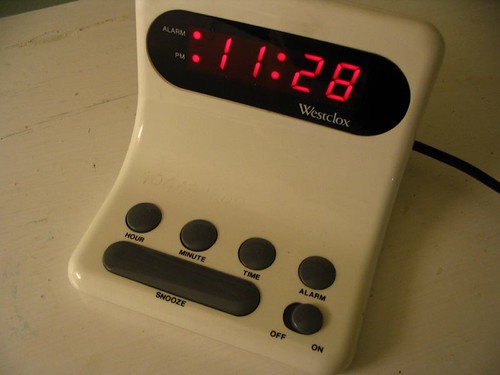
You are a GUI agent. You are given a task and a screenshot of the screen. Output one action in this format:
    pyautogui.click(x=<x>, y=<y>)
    Task: Click on the time on clock in red letters - 11:28
    This screenshot has height=375, width=500.
    Given the screenshot: What is the action you would take?
    pyautogui.click(x=227, y=47), pyautogui.click(x=261, y=50), pyautogui.click(x=304, y=72), pyautogui.click(x=336, y=83)